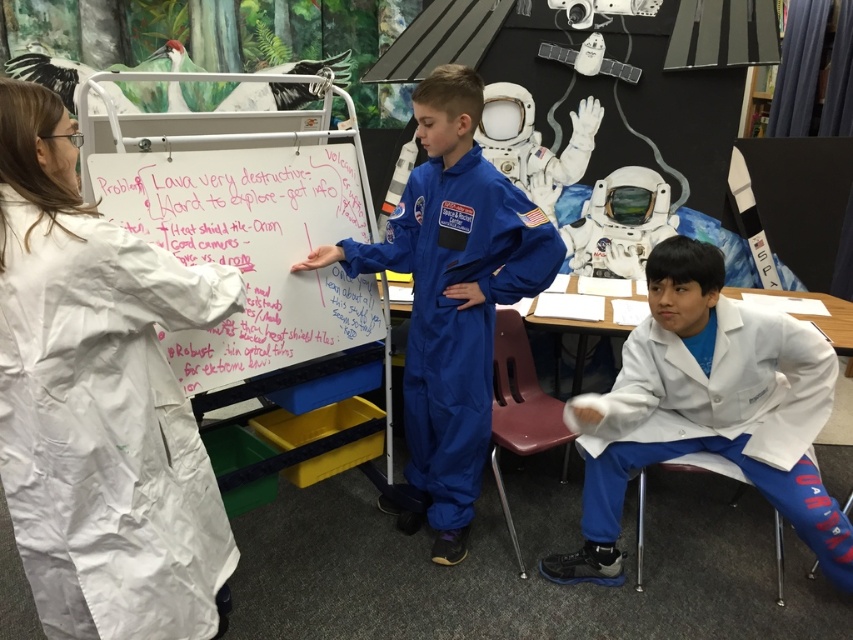
Is white matte lab coat at lower right above whiteboard at center?

Actually, white matte lab coat at lower right is below whiteboard at center.

Is white matte lab coat at lower right taller than whiteboard at center?

Yes.

Does point (654, 289) come in front of point (131, 202)?

No, it is behind (131, 202).

Locate an element on the screen. The image size is (853, 640). white matte lab coat at lower right is located at coordinates (706, 410).

Between blue smooth jumpsuit at center and whiteboard at center, which one is positioned lower?

Positioned lower is blue smooth jumpsuit at center.

Between point (442, 129) and point (297, 275), which one is positioned in front?

Point (442, 129) is in front.

Identify the location of blue smooth jumpsuit at center. This screenshot has height=640, width=853. (451, 296).

Does white matte lab coat at lower right appear under blue smooth jumpsuit at center?

Indeed, white matte lab coat at lower right is positioned under blue smooth jumpsuit at center.

Who is shorter, white matte lab coat at lower right or blue smooth jumpsuit at center?

Standing shorter between the two is white matte lab coat at lower right.

The height and width of the screenshot is (640, 853). In order to click on white matte lab coat at lower right in this screenshot , I will do `click(706, 410)`.

Find the location of `white matte lab coat at lower right`. white matte lab coat at lower right is located at coordinates (706, 410).